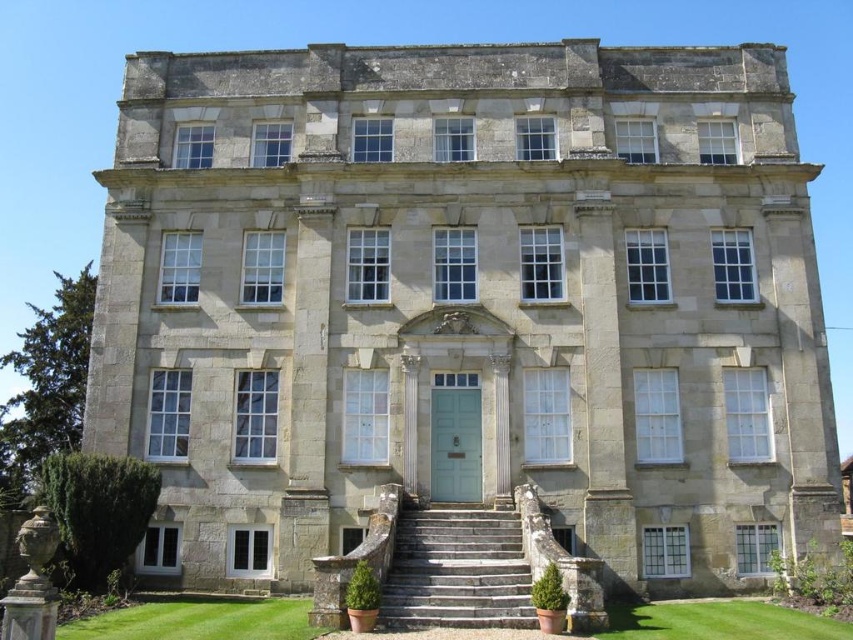
Question: Which is farther from the green grass at lower right?

Choices:
 (A) stone steps at center
 (B) green grass at lower center

Answer: (B)

Question: Does green grass at lower center have a smaller size compared to green grass at lower right?

Choices:
 (A) yes
 (B) no

Answer: (A)

Question: In this image, where is stone steps at center located relative to green grass at lower center?

Choices:
 (A) below
 (B) above

Answer: (B)

Question: Which point appears closest to the camera in this image?

Choices:
 (A) (496, 547)
 (B) (682, 637)

Answer: (B)

Question: Does stone steps at center appear on the right side of green grass at lower center?

Choices:
 (A) yes
 (B) no

Answer: (A)

Question: Among these objects, which one is farthest from the camera?

Choices:
 (A) green grass at lower right
 (B) green grass at lower center

Answer: (B)